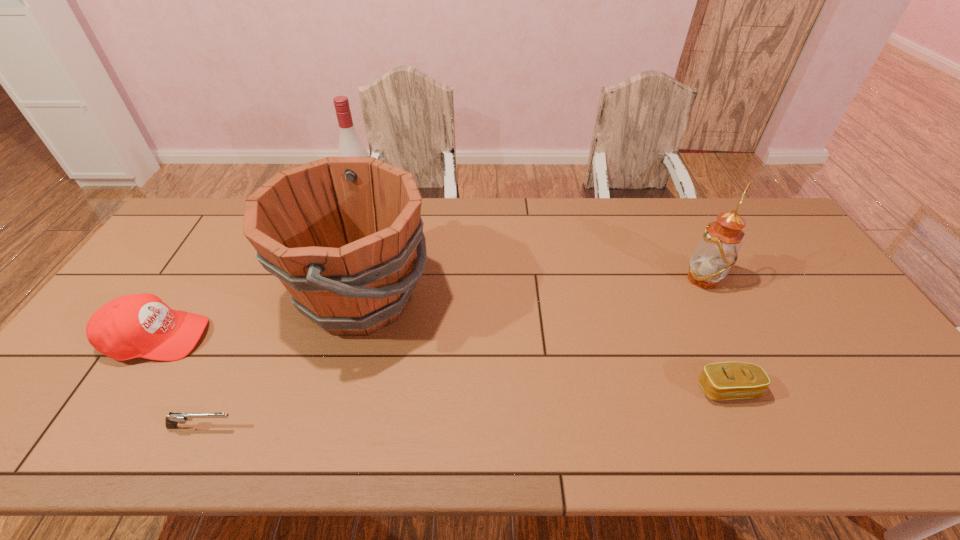
This screenshot has width=960, height=540. Identify the location of object that stands as the second closest to the oil lamp. (340, 233).

Locate an element on the screen. object that stands as the closest to the farthest object is located at coordinates (340, 233).

The height and width of the screenshot is (540, 960). I want to click on vacant point that satisfies the following two spatial constraints: 1. on the front side of the oil lamp; 2. on the front-facing side of the pistol, so click(778, 427).

This screenshot has width=960, height=540. Identify the location of free spot that satisfies the following two spatial constraints: 1. on the front side of the oil lamp; 2. on the front-facing side of the pistol. (778, 427).